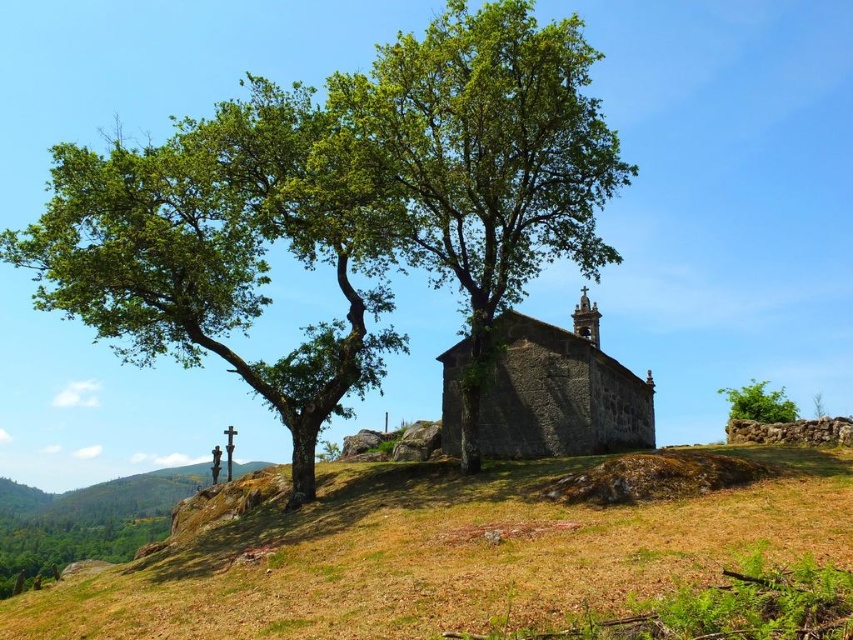
Based on the photo, you are a gardener who wants to plant a new flower bed between the dry grass at center and the green leafy bush at upper right. Considering their heights, which object will block more sunlight to the flower bed?

The dry grass at center is much taller than the green leafy bush at upper right, so it will block more sunlight to the flower bed.

You are a hiker standing at the base of the green leafy tree at left. You want to reach the dry grass at center to set up a picnic. Which direction should you walk to get there?

The dry grass at center is below the green leafy tree at left, so you should walk downward from the green leafy tree at left to reach the dry grass at center.

You are standing at the base of the large tree in the foreground of the rural landscape. You want to walk directly towards the small stone chapel on the hilltop. Will you step on the dry grass at center represented by point (450, 556) during your path?

Yes, since the dry grass at center is located along the direct path from the large tree to the chapel, stepping on it is unavoidable.